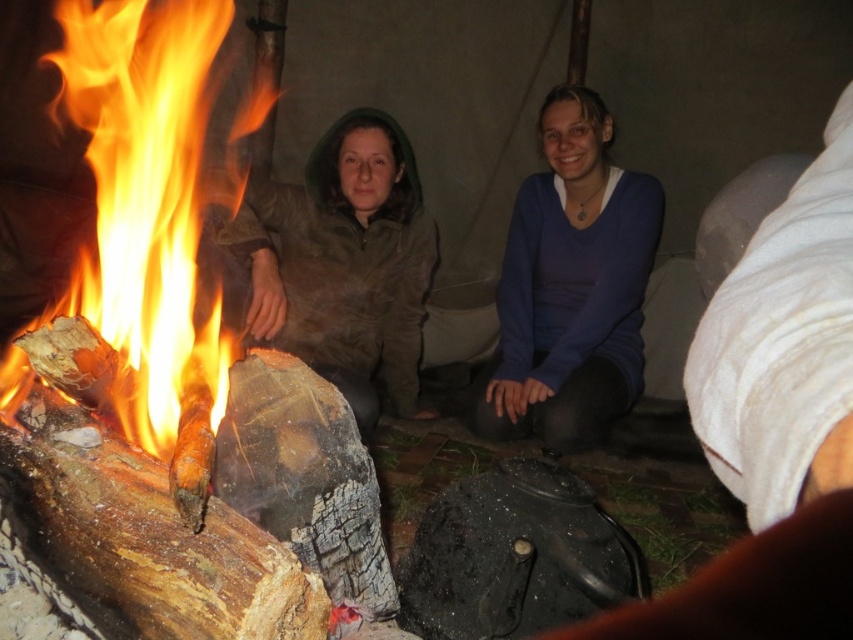
Looking at this image, which of these two, matte brown jacket at center or green matte jacket at center, stands taller?

matte brown jacket at center is taller.

Is point (585, 417) positioned before point (381, 339)?

That is True.

This screenshot has width=853, height=640. I want to click on matte brown jacket at center, so click(x=572, y=285).

Between charcoal wood fire at left and green matte jacket at center, which one has less height?

Standing shorter between the two is green matte jacket at center.

Can you confirm if charcoal wood fire at left is thinner than green matte jacket at center?

Correct, charcoal wood fire at left's width is less than green matte jacket at center's.

The height and width of the screenshot is (640, 853). Identify the location of charcoal wood fire at left. (148, 216).

This screenshot has height=640, width=853. Identify the location of charcoal wood fire at left. (148, 216).

Is charcoal wood fire at left positioned in front of blue sweater at center?

Yes, charcoal wood fire at left is in front of blue sweater at center.

Find the location of a particular element. The height and width of the screenshot is (640, 853). charcoal wood fire at left is located at coordinates (148, 216).

Locate an element on the screen. The image size is (853, 640). charcoal wood fire at left is located at coordinates (148, 216).